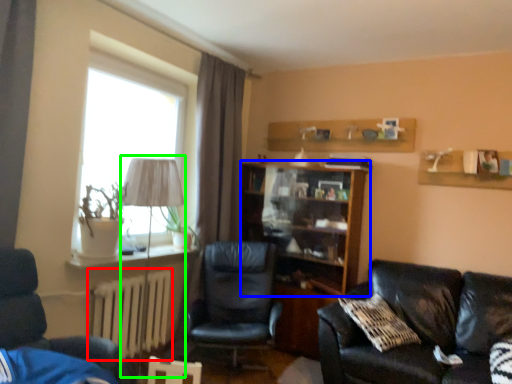
Question: Based on their relative distances, which object is nearer to radiator (highlighted by a red box)? Choose from shelf (highlighted by a blue box) and table lamp (highlighted by a green box).

Choices:
 (A) shelf
 (B) table lamp

Answer: (B)